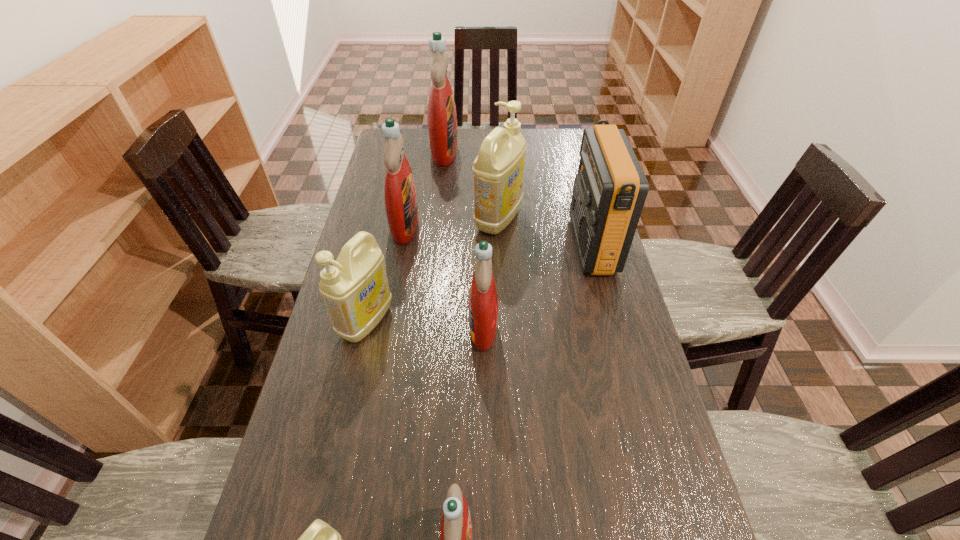
Locate an element on the screen. vacant point located on the front surface of the third smallest red detergent is located at coordinates (512, 226).

The width and height of the screenshot is (960, 540). Find the location of `blank space located 0.270m on the front-facing side of the radio receiver`. blank space located 0.270m on the front-facing side of the radio receiver is located at coordinates (489, 244).

Identify the location of free space located on the front-facing side of the radio receiver. The height and width of the screenshot is (540, 960). (468, 244).

Identify the location of vacant space located 0.260m on the front-facing side of the radio receiver. Image resolution: width=960 pixels, height=540 pixels. (492, 244).

Where is `vacant space located on the front surface of the third farthest red detergent`? This screenshot has width=960, height=540. vacant space located on the front surface of the third farthest red detergent is located at coordinates (395, 327).

At what (x,y) coordinates should I click in order to perform the action: click on free region located 0.120m on the front surface of the third farthest red detergent. Please return your answer as a coordinate pair (x, y). Looking at the image, I should click on (424, 327).

Identify the location of vacant space situated on the front surface of the third farthest red detergent. The width and height of the screenshot is (960, 540). (420, 327).

Locate an element on the screen. The width and height of the screenshot is (960, 540). vacant space located on the right of the second nearest beige detergent is located at coordinates (466, 322).

The image size is (960, 540). I want to click on object situated at the far edge, so click(442, 120).

This screenshot has height=540, width=960. Find the location of `object positioned at the right edge`. object positioned at the right edge is located at coordinates (610, 189).